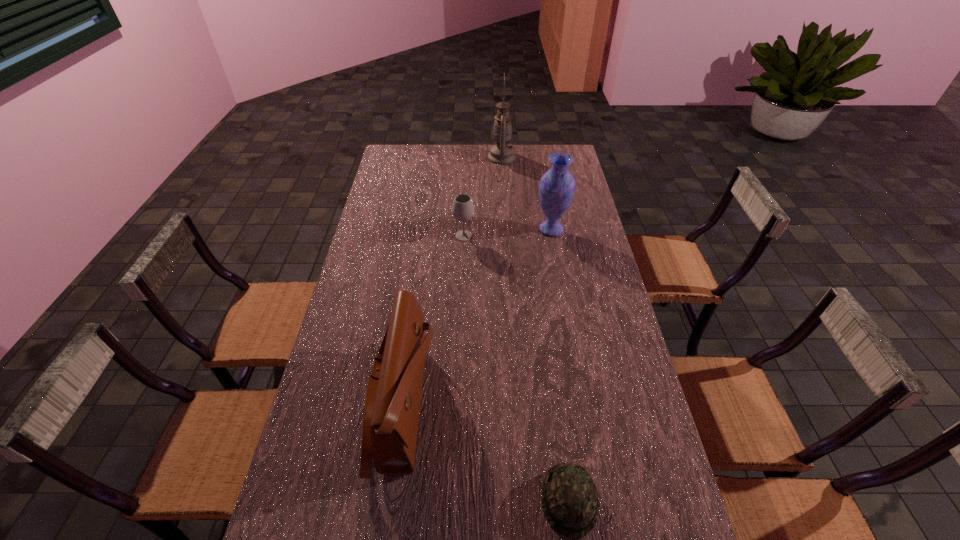
In order to click on vacant area that lies between the satchel and the second object from left to right in this screenshot , I will do `click(433, 320)`.

At what (x,y) coordinates should I click in order to perform the action: click on vacant region between the vase and the oil lamp. Please return your answer as a coordinate pair (x, y). The height and width of the screenshot is (540, 960). Looking at the image, I should click on click(x=526, y=193).

The height and width of the screenshot is (540, 960). Find the location of `vacant point located between the vase and the tallest object`. vacant point located between the vase and the tallest object is located at coordinates (526, 193).

Find the location of a particular element. This screenshot has height=540, width=960. vacant area that lies between the vase and the leftmost object is located at coordinates (476, 316).

This screenshot has height=540, width=960. Identify the location of free point between the oil lamp and the second shortest object. (483, 197).

Where is `blank region between the vase and the fourth object from right to left`? blank region between the vase and the fourth object from right to left is located at coordinates (508, 232).

This screenshot has height=540, width=960. I want to click on free space between the vase and the satchel, so click(476, 316).

Select which object appears as the third closest to the farthest object. Please provide its 2D coordinates. Your answer should be formatted as a tuple, i.e. [(x, y)], where the tuple contains the x and y coordinates of a point satisfying the conditions above.

[(392, 405)]

Where is `object that is the fourth closest one to the farthest object`? Image resolution: width=960 pixels, height=540 pixels. object that is the fourth closest one to the farthest object is located at coordinates (570, 502).

Identify the location of vacant space that satisfies the following two spatial constraints: 1. on the front flap of the leftmost object; 2. on the left side of the headwear. Image resolution: width=960 pixels, height=540 pixels. (388, 500).